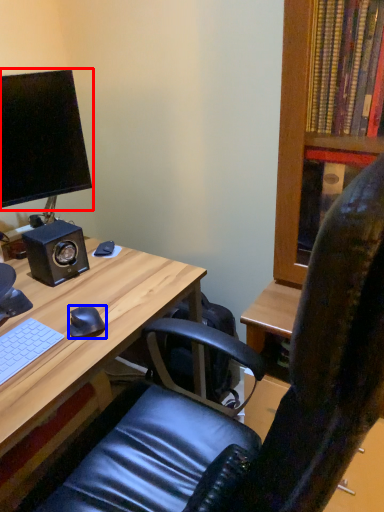
Question: Among these objects, which one is farthest to the camera, computer monitor (highlighted by a red box) or mouse (highlighted by a blue box)?

Choices:
 (A) computer monitor
 (B) mouse

Answer: (A)